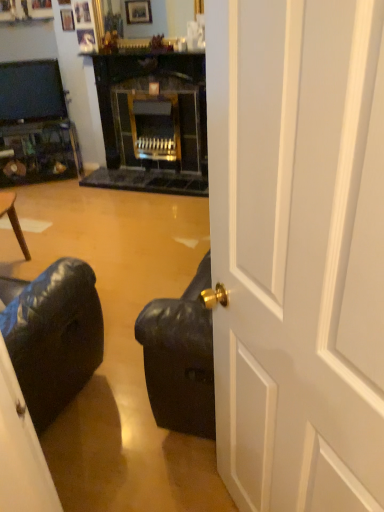
Question: Does white glossy door at center appear on the left side of matte black television at upper left?

Choices:
 (A) no
 (B) yes

Answer: (A)

Question: Is the surface of white glossy door at center in direct contact with matte black television at upper left?

Choices:
 (A) yes
 (B) no

Answer: (B)

Question: From the image's perspective, does white glossy door at center appear lower than matte black television at upper left?

Choices:
 (A) yes
 (B) no

Answer: (A)

Question: Is the position of white glossy door at center more distant than that of matte black television at upper left?

Choices:
 (A) no
 (B) yes

Answer: (A)

Question: Is white glossy door at center far away from matte black television at upper left?

Choices:
 (A) yes
 (B) no

Answer: (A)

Question: Considering the relative sizes of white glossy door at center and matte black television at upper left in the image provided, is white glossy door at center shorter than matte black television at upper left?

Choices:
 (A) yes
 (B) no

Answer: (B)

Question: Is matte black television at upper left facing towards white glossy door at center?

Choices:
 (A) yes
 (B) no

Answer: (A)

Question: From a real-world perspective, is matte black television at upper left located higher than white glossy door at center?

Choices:
 (A) no
 (B) yes

Answer: (B)

Question: Is matte black television at upper left turned away from white glossy door at center?

Choices:
 (A) no
 (B) yes

Answer: (A)

Question: From the image's perspective, is matte black television at upper left over white glossy door at center?

Choices:
 (A) yes
 (B) no

Answer: (A)

Question: Are matte black television at upper left and white glossy door at center located far from each other?

Choices:
 (A) yes
 (B) no

Answer: (A)

Question: Is matte black television at upper left closer to the viewer compared to white glossy door at center?

Choices:
 (A) no
 (B) yes

Answer: (A)

Question: Is white glossy door at center situated inside matte black television at upper left or outside?

Choices:
 (A) inside
 (B) outside

Answer: (B)